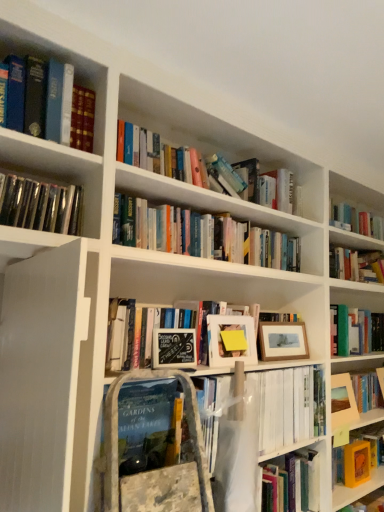
This screenshot has width=384, height=512. Describe the element at coordinates (174, 348) in the screenshot. I see `black chalkboard sign at center, the first paperback book viewed from the left` at that location.

At what (x,y) coordinates should I click in order to perform the action: click on hardcover books at upper left, acting as the 3th book starting from the bottom. Please return your answer as a coordinate pair (x, y). The width and height of the screenshot is (384, 512). Looking at the image, I should click on (52, 103).

The width and height of the screenshot is (384, 512). What do you see at coordinates (40, 205) in the screenshot? I see `shiny black vinyl records at upper left, which is the second book from top to bottom` at bounding box center [40, 205].

This screenshot has height=512, width=384. Describe the element at coordinates (342, 401) in the screenshot. I see `matte wooden picture frame at right, which appears as the 1th picture frame when ordered from the bottom` at that location.

I want to click on hardcover book at center, positioned as the third book in top-to-bottom order, so (x=149, y=425).

Which is farther, (254, 351) or (344, 462)?

Point (344, 462)

Is matte white picture frame at center, the first picture frame from the front, taller or shorter than yellow matte book at lower right, the 1th paperback book positioned from the back?

Clearly, matte white picture frame at center, the first picture frame from the front, is taller compared to yellow matte book at lower right, the 1th paperback book positioned from the back.

Is matte white picture frame at center, which is the 1th picture frame from top to bottom, facing away from yellow matte book at lower right, which appears as the second paperback book when viewed from the top?

matte white picture frame at center, which is the 1th picture frame from top to bottom, does not have its back to yellow matte book at lower right, which appears as the second paperback book when viewed from the top.

Which object is positioned more to the right, matte white picture frame at center, which is counted as the 1th picture frame, starting from the left, or yellow matte book at lower right, which appears as the second paperback book when viewed from the top?

yellow matte book at lower right, which appears as the second paperback book when viewed from the top.

Looking at their sizes, would you say hardcover books at upper left, acting as the 3th book starting from the bottom, is wider or thinner than wooden picture frame at center-right, acting as the 2th picture frame starting from the left?

Considering their sizes, hardcover books at upper left, acting as the 3th book starting from the bottom, looks broader than wooden picture frame at center-right, acting as the 2th picture frame starting from the left.

Which of these two, hardcover books at upper left, acting as the 3th book starting from the bottom, or wooden picture frame at center-right, acting as the 2th picture frame starting from the left, stands taller?

Standing taller between the two is hardcover books at upper left, acting as the 3th book starting from the bottom.

From a real-world perspective, who is located higher, hardcover books at upper left, positioned as the 1th book in top-to-bottom order, or wooden picture frame at center-right, acting as the 2th picture frame starting from the left?

hardcover books at upper left, positioned as the 1th book in top-to-bottom order, from a real-world perspective.

From the image's perspective, which is below, hardcover books at upper left, acting as the 3th book starting from the bottom, or wooden picture frame at center-right, the second picture frame when ordered from front to back?

wooden picture frame at center-right, the second picture frame when ordered from front to back, from the image's perspective.

Does point (46, 230) appear closer or farther from the camera than point (178, 343)?

Point (46, 230) is positioned closer to the camera compared to point (178, 343).

In the scene shown: Looking at the image, does shiny black vinyl records at upper left, which is the 2th book from bottom to top, seem bigger or smaller compared to black chalkboard sign at center, the second paperback book in the back-to-front sequence?

In the image, shiny black vinyl records at upper left, which is the 2th book from bottom to top, appears to be larger than black chalkboard sign at center, the second paperback book in the back-to-front sequence.

Looking at their sizes, would you say shiny black vinyl records at upper left, which is the second book from top to bottom, is wider or thinner than black chalkboard sign at center, which ranks as the first paperback book in top-to-bottom order?

Clearly, shiny black vinyl records at upper left, which is the second book from top to bottom, has more width compared to black chalkboard sign at center, which ranks as the first paperback book in top-to-bottom order.

Would you say black chalkboard sign at center, the first paperback book viewed from the left, is part of shiny black vinyl records at upper left, which is the second book from top to bottom,'s contents?

That's incorrect, black chalkboard sign at center, the first paperback book viewed from the left, is not inside shiny black vinyl records at upper left, which is the second book from top to bottom.

Does yellow matte book at lower right, the 1th paperback book positioned from the back, appear on the left side of black chalkboard sign at center, the first paperback book viewed from the left?

Incorrect, yellow matte book at lower right, the 1th paperback book positioned from the back, is not on the left side of black chalkboard sign at center, the first paperback book viewed from the left.

Is black chalkboard sign at center, the first paperback book from the front, at the back of yellow matte book at lower right, which appears as the second paperback book when viewed from the top?

No, yellow matte book at lower right, which appears as the second paperback book when viewed from the top,'s orientation is not away from black chalkboard sign at center, the first paperback book from the front.

Is yellow matte book at lower right, the 1th paperback book positioned from the back, surrounding black chalkboard sign at center, the first paperback book from the front?

No, black chalkboard sign at center, the first paperback book from the front, is not a part of yellow matte book at lower right, the 1th paperback book positioned from the back.

From a real-world perspective, which is physically above, yellow matte book at lower right, arranged as the first paperback book when viewed from the right, or black chalkboard sign at center, which is the second paperback book in right-to-left order?

black chalkboard sign at center, which is the second paperback book in right-to-left order, is physically above.

Considering the positions of objects black chalkboard sign at center, which is the 2th paperback book in bottom-to-top order, and hardcover book at center, positioned as the third book in top-to-bottom order, in the image provided, who is more to the right, black chalkboard sign at center, which is the 2th paperback book in bottom-to-top order, or hardcover book at center, positioned as the third book in top-to-bottom order,?

From the viewer's perspective, black chalkboard sign at center, which is the 2th paperback book in bottom-to-top order, appears more on the right side.

How different are the orientations of black chalkboard sign at center, the first paperback book viewed from the left, and hardcover book at center, which is the 1th book from bottom to top, in degrees?

black chalkboard sign at center, the first paperback book viewed from the left, and hardcover book at center, which is the 1th book from bottom to top, are facing 1.51 degrees away from each other.

Which object is further away from the camera, black chalkboard sign at center, which is the second paperback book in right-to-left order, or hardcover book at center, positioned as the third book in top-to-bottom order?

black chalkboard sign at center, which is the second paperback book in right-to-left order, is behind.

Consider the image. Is black chalkboard sign at center, the second paperback book in the back-to-front sequence, facing towards hardcover book at center, which is the 1th book from bottom to top?

No, black chalkboard sign at center, the second paperback book in the back-to-front sequence, is not facing towards hardcover book at center, which is the 1th book from bottom to top.

Considering the positions of points (102, 443) and (357, 442), is point (102, 443) closer to camera compared to point (357, 442)?

Yes, it is in front of point (357, 442).

Is yellow matte book at lower right, arranged as the first paperback book when viewed from the right, completely or partially inside hardcover book at center, which is the 1th book from bottom to top?

Actually, yellow matte book at lower right, arranged as the first paperback book when viewed from the right, is outside hardcover book at center, which is the 1th book from bottom to top.

You are a GUI agent. You are given a task and a screenshot of the screen. Output one action in this format:
    pyautogui.click(x=<x>, y=<y>)
    Task: Click on the 1st book to the left of the yellow matte book at lower right, which is the first paperback book in bottom-to-top order, counting from the anchor's position
    The height and width of the screenshot is (512, 384).
    Given the screenshot: What is the action you would take?
    pyautogui.click(x=149, y=425)

From the image's perspective, does hardcover book at center, which is the 1th book from bottom to top, appear lower than yellow matte book at lower right, which appears as the second paperback book when viewed from the top?

No, from the image's perspective, hardcover book at center, which is the 1th book from bottom to top, is not below yellow matte book at lower right, which appears as the second paperback book when viewed from the top.

Is wooden picture frame at center-right, which appears as the second picture frame when ordered from the bottom, oriented away from matte white picture frame at center, marked as the 3th picture frame in a right-to-left arrangement?

No, wooden picture frame at center-right, which appears as the second picture frame when ordered from the bottom, is not facing the opposite direction of matte white picture frame at center, marked as the 3th picture frame in a right-to-left arrangement.

Considering the relative sizes of wooden picture frame at center-right, which appears as the second picture frame when ordered from the bottom, and matte white picture frame at center, which is counted as the 1th picture frame, starting from the left, in the image provided, is wooden picture frame at center-right, which appears as the second picture frame when ordered from the bottom, bigger than matte white picture frame at center, which is counted as the 1th picture frame, starting from the left,?

Yes.

Considering the positions of objects wooden picture frame at center-right, the 2th picture frame from the right, and matte white picture frame at center, which is the 1th picture frame from top to bottom, in the image provided, who is more to the left, wooden picture frame at center-right, the 2th picture frame from the right, or matte white picture frame at center, which is the 1th picture frame from top to bottom,?

matte white picture frame at center, which is the 1th picture frame from top to bottom.

From a real-world perspective, does wooden picture frame at center-right, the second picture frame viewed from the top, sit lower than matte white picture frame at center, marked as the third picture frame in a bottom-to-top arrangement?

Yes.

There is a matte white picture frame at center, marked as the 3th picture frame in a right-to-left arrangement. Identify the location of the 2nd paperback book below it (from the image's perspective). (356, 463).

Where is `the 2nd book in front of the wooden picture frame at center-right, the 2th picture frame from the right, starting your count from the anchor`? This screenshot has width=384, height=512. the 2nd book in front of the wooden picture frame at center-right, the 2th picture frame from the right, starting your count from the anchor is located at coordinates (52, 103).

Based on the photo, when comparing their distances from hardcover books at upper left, positioned as the 1th book in top-to-bottom order, does hardcover book at center, positioned as the third book in top-to-bottom order, or wooden picture frame at center-right, the second picture frame when ordered from front to back, seem closer?

Based on the image, hardcover book at center, positioned as the third book in top-to-bottom order, appears to be nearer to hardcover books at upper left, positioned as the 1th book in top-to-bottom order.

Estimate the real-world distances between objects in this image. Which object is further from yellow matte book at lower right, arranged as the first paperback book when viewed from the right, shiny black vinyl records at upper left, which is the 2th book from bottom to top, or wooden picture frame at center-right, the 2th picture frame from the right?

shiny black vinyl records at upper left, which is the 2th book from bottom to top, is further to yellow matte book at lower right, arranged as the first paperback book when viewed from the right.

Considering their positions, is shiny black vinyl records at upper left, which is the second book from top to bottom, positioned further to matte white picture frame at center, the first picture frame from the front, than black chalkboard sign at center, which ranks as the first paperback book in top-to-bottom order?

Based on the image, shiny black vinyl records at upper left, which is the second book from top to bottom, appears to be further to matte white picture frame at center, the first picture frame from the front.

Looking at the image, which one is located closer to shiny black vinyl records at upper left, which is the second book from top to bottom, wooden picture frame at center-right, the 2th picture frame from the right, or hardcover books at upper left, acting as the 3th book starting from the bottom?

hardcover books at upper left, acting as the 3th book starting from the bottom, is closer to shiny black vinyl records at upper left, which is the second book from top to bottom.

Looking at the image, which one is located further to hardcover books at upper left, positioned as the 1th book in top-to-bottom order, matte white picture frame at center, which is counted as the 1th picture frame, starting from the left, or hardcover book at center, which is the 1th book from bottom to top?

Based on the image, matte white picture frame at center, which is counted as the 1th picture frame, starting from the left, appears to be further to hardcover books at upper left, positioned as the 1th book in top-to-bottom order.

From the image, which object appears to be nearer to yellow matte book at lower right, arranged as the first paperback book when viewed from the right, matte white picture frame at center, marked as the third picture frame in a bottom-to-top arrangement, or wooden picture frame at center-right, the 2th picture frame from the right?

wooden picture frame at center-right, the 2th picture frame from the right, is positioned closer to the anchor yellow matte book at lower right, arranged as the first paperback book when viewed from the right.

Which object lies nearer to the anchor point black chalkboard sign at center, which is the second paperback book in right-to-left order, matte white picture frame at center, which is the 1th picture frame from top to bottom, or shiny black vinyl records at upper left, which is the 2th book from bottom to top?

matte white picture frame at center, which is the 1th picture frame from top to bottom, is positioned closer to the anchor black chalkboard sign at center, which is the second paperback book in right-to-left order.

Based on their spatial positions, is hardcover books at upper left, acting as the 3th book starting from the bottom, or wooden picture frame at center-right, acting as the 2th picture frame starting from the left, further from yellow matte book at lower right, the second paperback book in the front-to-back sequence?

Based on the image, hardcover books at upper left, acting as the 3th book starting from the bottom, appears to be further to yellow matte book at lower right, the second paperback book in the front-to-back sequence.

Where is `picture frame between matte white picture frame at center, marked as the 3th picture frame in a right-to-left arrangement, and matte wooden picture frame at right, arranged as the 3th picture frame when viewed from the left, from left to right`? This screenshot has width=384, height=512. picture frame between matte white picture frame at center, marked as the 3th picture frame in a right-to-left arrangement, and matte wooden picture frame at right, arranged as the 3th picture frame when viewed from the left, from left to right is located at coordinates (283, 341).

Image resolution: width=384 pixels, height=512 pixels. I want to click on paperback book between hardcover book at center, positioned as the third book in top-to-bottom order, and yellow matte book at lower right, the 1th paperback book positioned from the back, so click(x=174, y=348).

The width and height of the screenshot is (384, 512). Find the location of `picture frame between wooden picture frame at center-right, which appears as the second picture frame when ordered from the bottom, and yellow matte book at lower right, which appears as the second paperback book when viewed from the top, from top to bottom`. picture frame between wooden picture frame at center-right, which appears as the second picture frame when ordered from the bottom, and yellow matte book at lower right, which appears as the second paperback book when viewed from the top, from top to bottom is located at coordinates (342, 401).

Locate an element on the screen. The height and width of the screenshot is (512, 384). book between hardcover books at upper left, positioned as the 1th book in top-to-bottom order, and matte white picture frame at center, the first picture frame from the front, in the up-down direction is located at coordinates (40, 205).